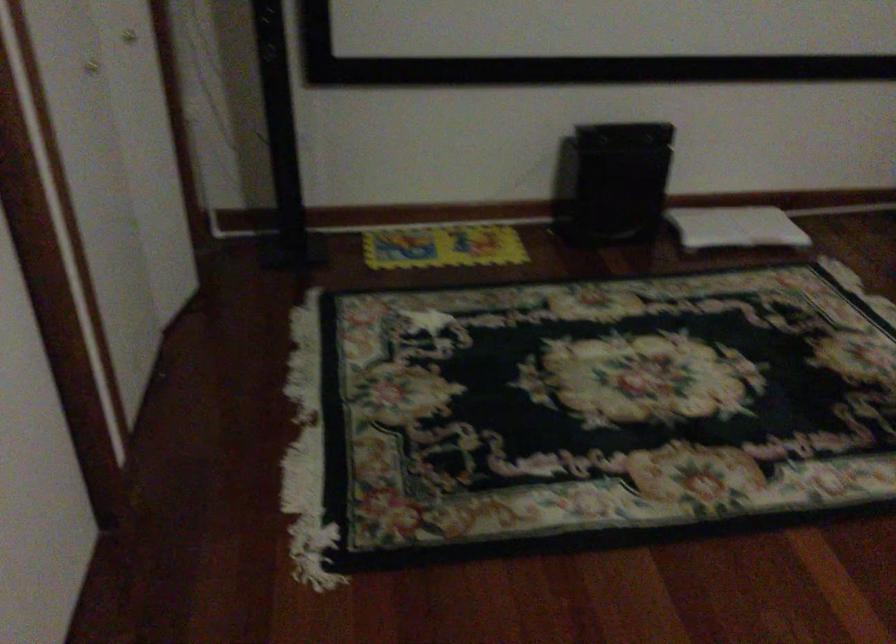
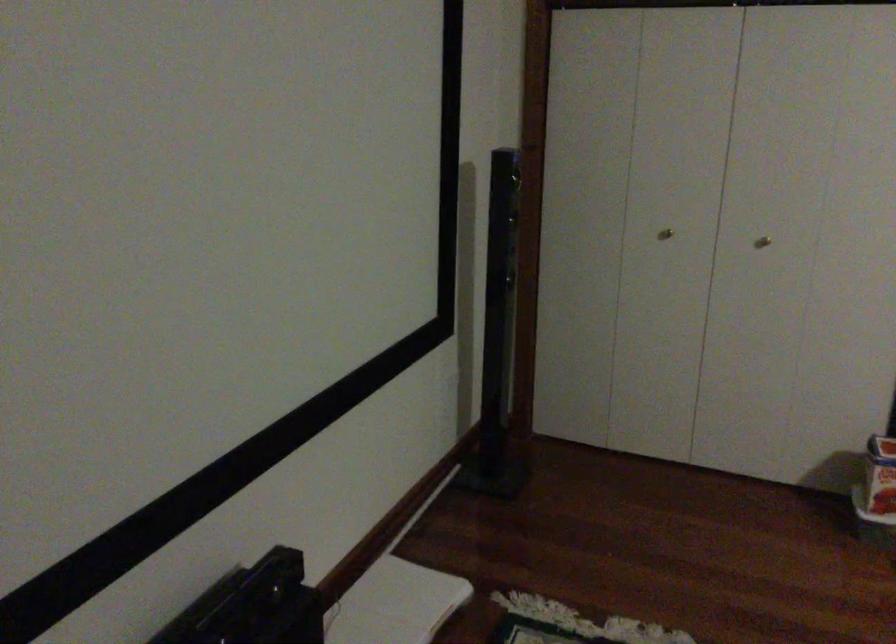
Find the pixel in the second image that matches point 762,216 in the first image.

(394, 603)